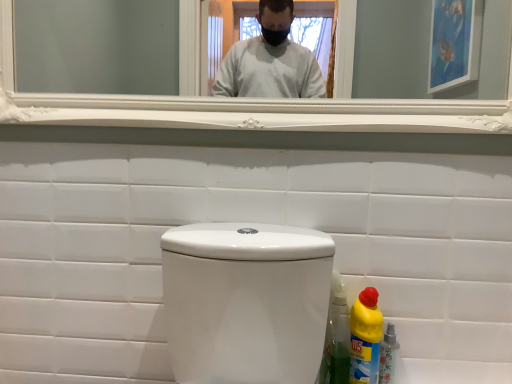
Question: From the image's perspective, does yellow plastic bottle at lower right, which appears as the 2th bottle when viewed from the right, appear higher than white glossy toilet at center?

Choices:
 (A) yes
 (B) no

Answer: (B)

Question: Is yellow plastic bottle at lower right, the first bottle in the left-to-right sequence, at the right side of white glossy toilet at center?

Choices:
 (A) no
 (B) yes

Answer: (B)

Question: Does yellow plastic bottle at lower right, which appears as the 2th bottle when viewed from the right, have a greater height compared to white glossy toilet at center?

Choices:
 (A) yes
 (B) no

Answer: (B)

Question: Does yellow plastic bottle at lower right, which appears as the 2th bottle when viewed from the right, contain white glossy toilet at center?

Choices:
 (A) yes
 (B) no

Answer: (B)

Question: From a real-world perspective, is yellow plastic bottle at lower right, which appears as the 2th bottle when viewed from the right, physically above white glossy toilet at center?

Choices:
 (A) no
 (B) yes

Answer: (A)

Question: Is point (488, 329) closer or farther from the camera than point (389, 329)?

Choices:
 (A) farther
 (B) closer

Answer: (B)

Question: From the image's perspective, is white glossy toilet at center positioned above or below yellow plastic bottle at lower right, positioned as the 2th bottle in left-to-right order?

Choices:
 (A) above
 (B) below

Answer: (A)

Question: Based on their positions, is white glossy toilet at center located to the left or right of yellow plastic bottle at lower right, positioned as the 2th bottle in left-to-right order?

Choices:
 (A) left
 (B) right

Answer: (A)

Question: Is white glossy toilet at center inside the boundaries of yellow plastic bottle at lower right, which is counted as the first bottle, starting from the right, or outside?

Choices:
 (A) inside
 (B) outside

Answer: (B)

Question: Looking at their shapes, would you say yellow plastic bottle at lower right, which appears as the 2th bottle when viewed from the right, is wider or thinner than white glossy mirror at upper center?

Choices:
 (A) thin
 (B) wide

Answer: (B)

Question: From the image's perspective, is yellow plastic bottle at lower right, the first bottle in the left-to-right sequence, above or below white glossy mirror at upper center?

Choices:
 (A) below
 (B) above

Answer: (A)

Question: In the image, is yellow plastic bottle at lower right, the first bottle in the left-to-right sequence, on the left side or the right side of white glossy mirror at upper center?

Choices:
 (A) left
 (B) right

Answer: (B)

Question: Considering their positions, is yellow plastic bottle at lower right, which appears as the 2th bottle when viewed from the right, located in front of or behind white glossy mirror at upper center?

Choices:
 (A) front
 (B) behind

Answer: (B)

Question: In terms of height, does white glossy toilet at center look taller or shorter compared to white glossy mirror at upper center?

Choices:
 (A) tall
 (B) short

Answer: (A)

Question: From a real-world perspective, is white glossy toilet at center positioned above or below white glossy mirror at upper center?

Choices:
 (A) above
 (B) below

Answer: (B)